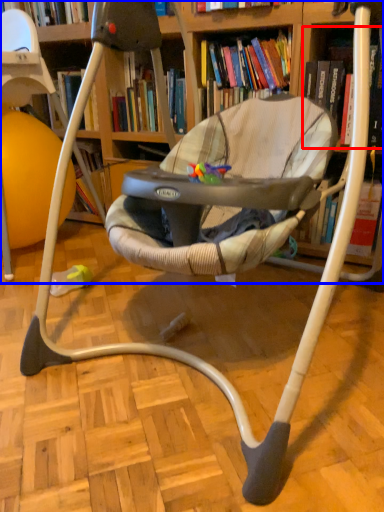
Question: Among these objects, which one is farthest to the camera, book (highlighted by a red box) or bookcase (highlighted by a blue box)?

Choices:
 (A) book
 (B) bookcase

Answer: (A)